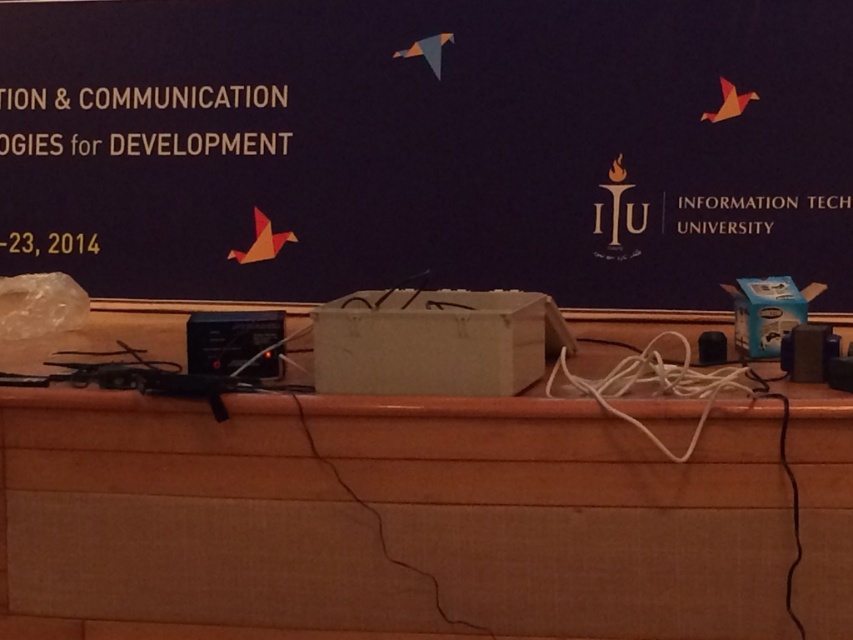
Question: Which of the following is the farthest from the observer?

Choices:
 (A) matte cardboard bulletin board at center
 (B) wooden table at center

Answer: (A)

Question: Which point is farther to the camera?

Choices:
 (A) (122, 400)
 (B) (352, 211)

Answer: (B)

Question: Does matte cardboard bulletin board at center appear on the left side of wooden table at center?

Choices:
 (A) no
 (B) yes

Answer: (B)

Question: Is matte cardboard bulletin board at center to the right of wooden table at center from the viewer's perspective?

Choices:
 (A) no
 (B) yes

Answer: (A)

Question: Which object appears farthest from the camera in this image?

Choices:
 (A) wooden table at center
 (B) matte cardboard bulletin board at center

Answer: (B)

Question: Does matte cardboard bulletin board at center have a smaller size compared to wooden table at center?

Choices:
 (A) yes
 (B) no

Answer: (B)